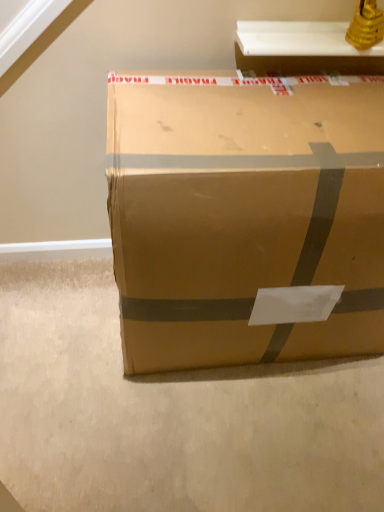
The height and width of the screenshot is (512, 384). Identify the location of vacant area on top of white glossy shelf at upper center (from a real-world perspective). (307, 28).